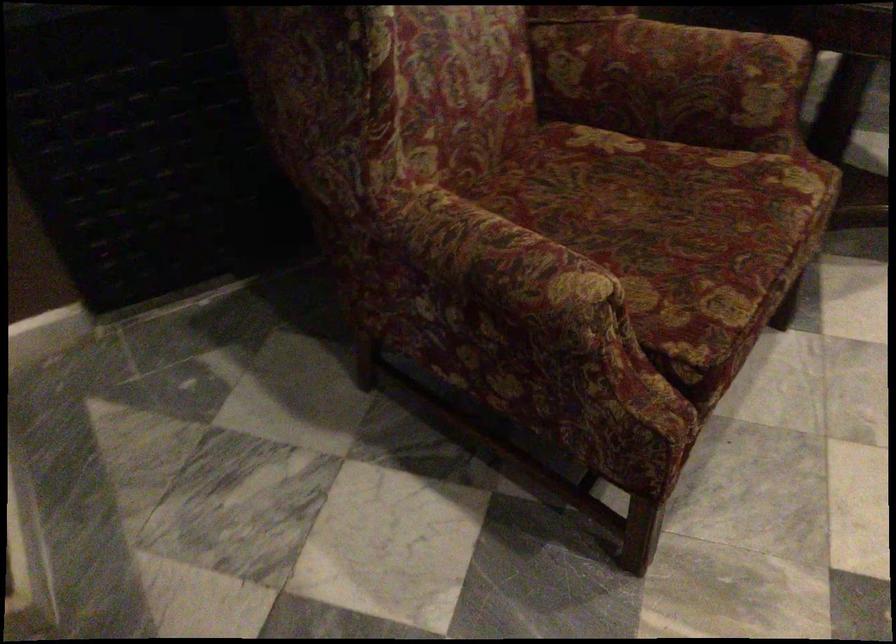
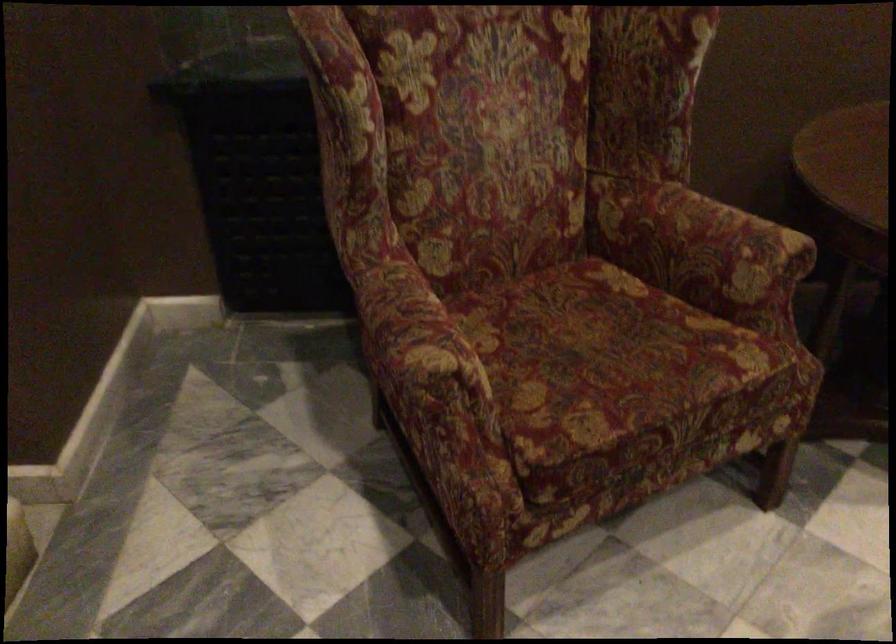
Question: Which direction would the cameraman need to move to produce the second image? Reply with the corresponding letter.

Choices:
 (A) Left
 (B) Right
 (C) Forward
 (D) Backward

Answer: (B)